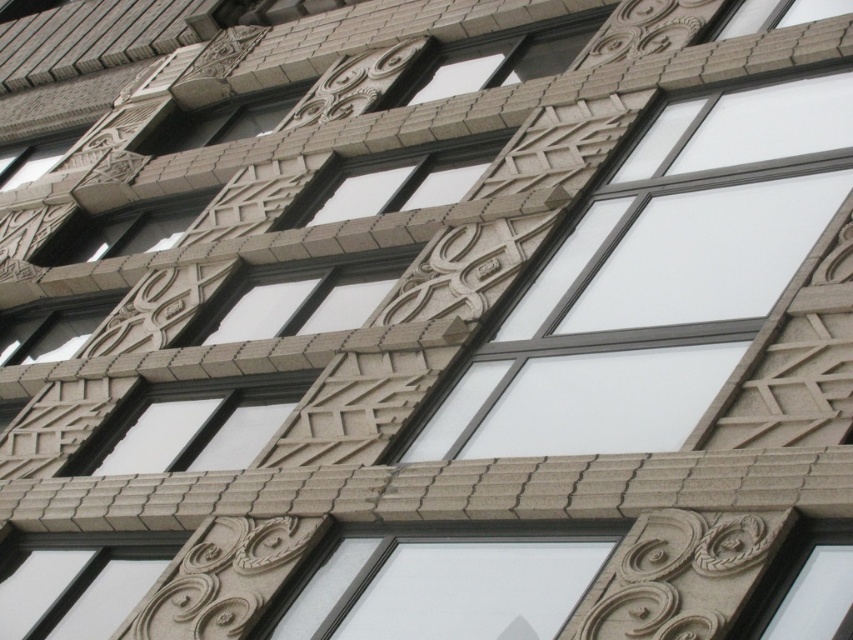
Which is in front, point (213, 408) or point (457, 179)?

Point (213, 408) is more forward.

Locate an element on the screen. The image size is (853, 640). clear glass window at center is located at coordinates (198, 429).

In the scene shown: Between smooth gray stone window at center and clear glass window at upper left, which one is positioned lower?

Positioned lower is smooth gray stone window at center.

Is smooth gray stone window at center thinner than clear glass window at upper left?

No, smooth gray stone window at center is not thinner than clear glass window at upper left.

Locate an element on the screen. Image resolution: width=853 pixels, height=640 pixels. smooth gray stone window at center is located at coordinates (399, 180).

Who is more forward, (202, 426) or (54, 156)?

Positioned in front is point (202, 426).

Is point (129, 445) more distant than point (0, 168)?

No, (129, 445) is closer to viewer.

The height and width of the screenshot is (640, 853). Identify the location of clear glass window at center. coord(198,429).